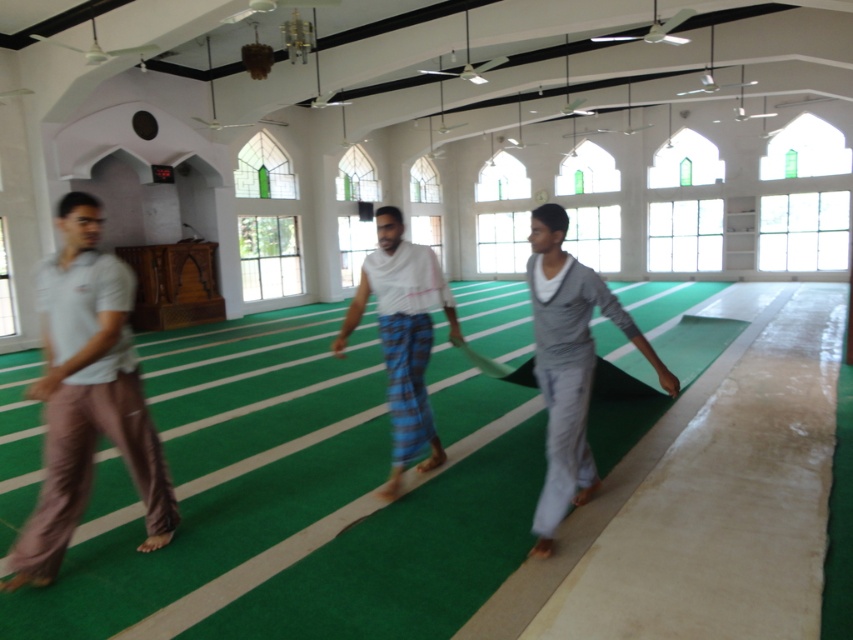
You are a visitor to the mosque and notice two pairs of pants left unattended. The light brown cotton pants at left and the gray cotton pants at center. Which pair has a greater width?

The light brown cotton pants at left has a greater width than the gray cotton pants at center.

You are a visitor standing at the entrance of the mosque. You need to place a small prayer rug between the light brown cotton pants at left and the white woven cloth at center. The rug is 3 feet wide. Can you fit it between them without overlapping either object?

The distance between the light brown cotton pants at left and the white woven cloth at center is 5.50 feet. Since the rug is 3 feet wide, there is enough space to place it between them without overlapping either object.